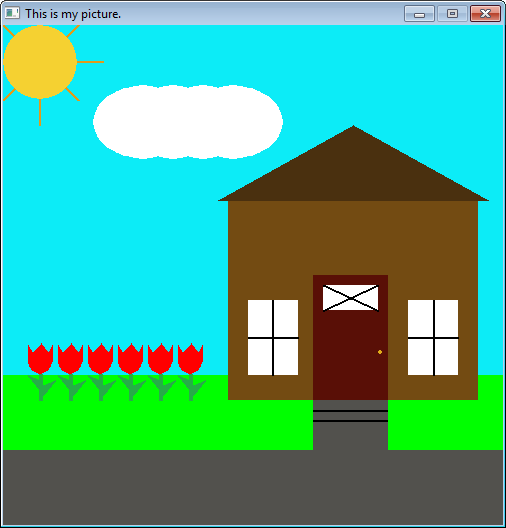
Find the location of a particular element. The image size is (506, 528). door is located at coordinates pyautogui.click(x=353, y=345).